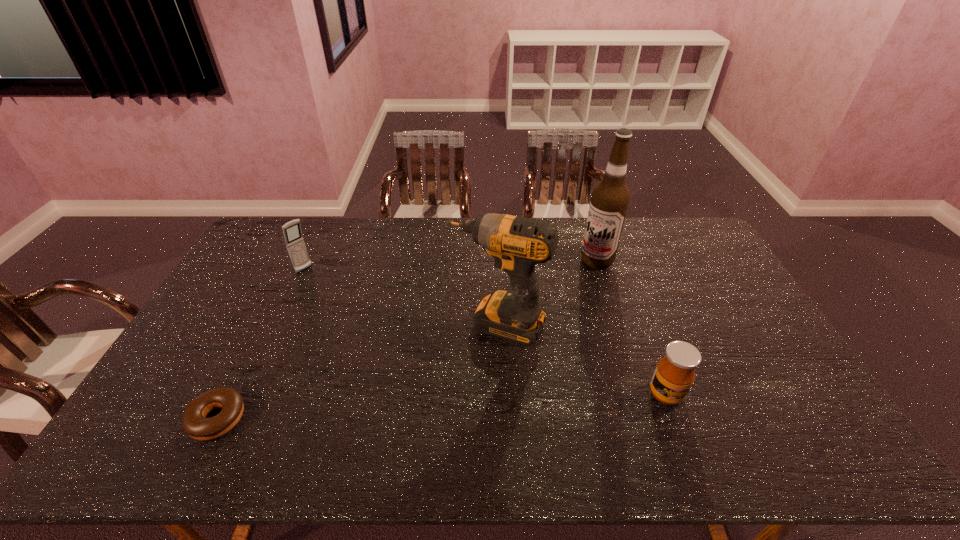
At what (x,y) coordinates should I click in order to perform the action: click on free space between the third nearest object and the doughnut. Please return your answer as a coordinate pair (x, y). Looking at the image, I should click on (357, 372).

You are a GUI agent. You are given a task and a screenshot of the screen. Output one action in this format:
    pyautogui.click(x=<x>, y=<y>)
    Task: Click on the vacant space that is in between the third tallest object and the fourth shortest object
    
    Given the screenshot: What is the action you would take?
    pyautogui.click(x=400, y=297)

The width and height of the screenshot is (960, 540). Identify the location of empty location between the alcohol and the fourth tallest object. (632, 327).

Identify the location of free spot between the tallest object and the doughnut. (407, 340).

The width and height of the screenshot is (960, 540). What are the coordinates of `empty location between the third tallest object and the tallest object` in the screenshot? It's located at (451, 265).

Identify which object is located as the second nearest to the cellular telephone. Please provide its 2D coordinates. Your answer should be formatted as a tuple, i.e. [(x, y)], where the tuple contains the x and y coordinates of a point satisfying the conditions above.

[(517, 243)]

Choose which object is the second nearest neighbor to the doughnut. Please provide its 2D coordinates. Your answer should be formatted as a tuple, i.e. [(x, y)], where the tuple contains the x and y coordinates of a point satisfying the conditions above.

[(517, 243)]

Locate an element on the screen. Image resolution: width=960 pixels, height=540 pixels. vacant point that satisfies the following two spatial constraints: 1. on the front side of the third tallest object; 2. on the left side of the drill is located at coordinates (279, 325).

What are the coordinates of `free space that satisfies the following two spatial constraints: 1. on the back side of the tallest object; 2. on the left side of the shortest object` in the screenshot? It's located at (297, 260).